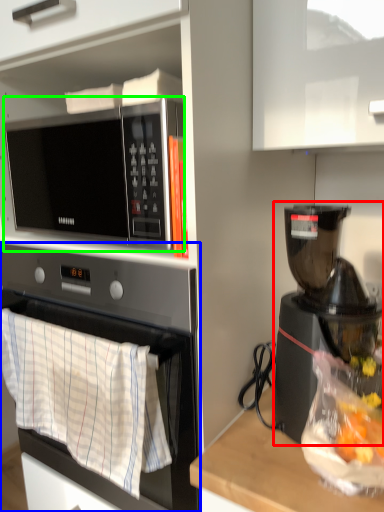
Question: Which object is positioned closest to coffee maker (highlighted by a red box)? Select from oven (highlighted by a blue box) and microwave oven (highlighted by a green box).

Choices:
 (A) oven
 (B) microwave oven

Answer: (A)